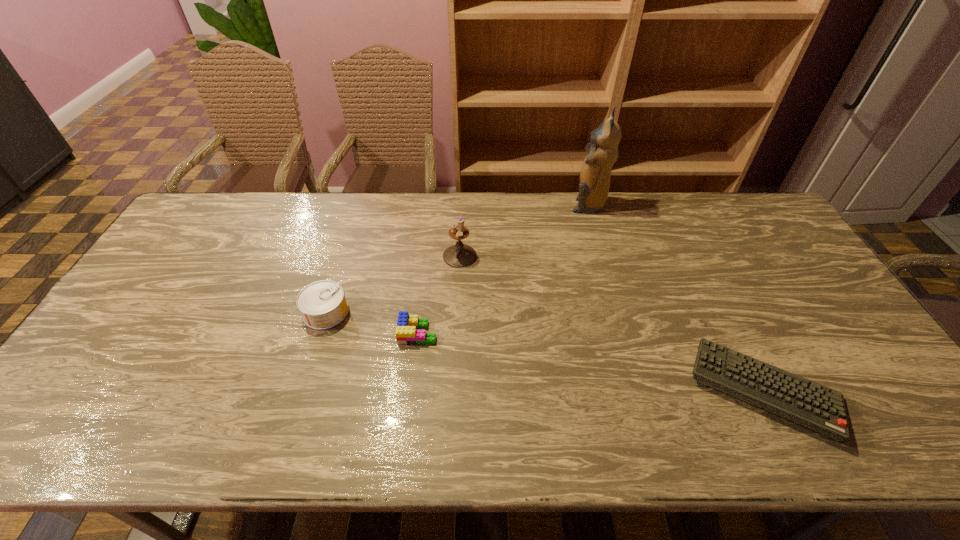
Identify the location of blank region between the Lego and the tallest object. This screenshot has width=960, height=540. (503, 269).

This screenshot has width=960, height=540. In order to click on vacant area that lies between the computer keyboard and the candle holder in this screenshot , I will do `click(612, 322)`.

Identify which object is located as the nearest to the fourth nearest object. Please provide its 2D coordinates. Your answer should be formatted as a tuple, i.e. [(x, y)], where the tuple contains the x and y coordinates of a point satisfying the conditions above.

[(406, 333)]

What are the coordinates of `object that is the fourth nearest to the Lego` in the screenshot? It's located at (594, 178).

Where is `vacant point that satisfies the following two spatial constraints: 1. on the face of the cat; 2. on the front side of the second farthest object`? vacant point that satisfies the following two spatial constraints: 1. on the face of the cat; 2. on the front side of the second farthest object is located at coordinates (602, 256).

Where is `vacant point that satisfies the following two spatial constraints: 1. on the face of the farthest object; 2. on the front side of the third shortest object`? The height and width of the screenshot is (540, 960). vacant point that satisfies the following two spatial constraints: 1. on the face of the farthest object; 2. on the front side of the third shortest object is located at coordinates [617, 312].

Locate an element on the screen. The image size is (960, 540). vacant space that satisfies the following two spatial constraints: 1. on the back side of the candle holder; 2. on the left side of the Lego is located at coordinates (427, 256).

Identify the location of blank area in the image that satisfies the following two spatial constraints: 1. on the front side of the second farthest object; 2. on the right side of the computer keyboard. click(x=454, y=389).

The width and height of the screenshot is (960, 540). Find the location of `vacant space that satisfies the following two spatial constraints: 1. on the face of the computer keyboard; 2. on the left side of the fourth object from left to right`. vacant space that satisfies the following two spatial constraints: 1. on the face of the computer keyboard; 2. on the left side of the fourth object from left to right is located at coordinates (639, 389).

I want to click on vacant space that satisfies the following two spatial constraints: 1. on the face of the fourth object from left to right; 2. on the back side of the computer keyboard, so click(639, 389).